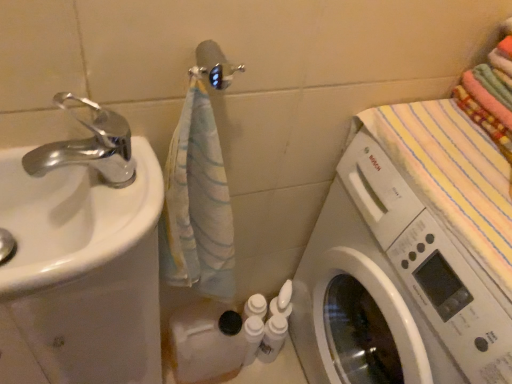
Question: Can you confirm if chrome metallic faucet at left is shorter than white plastic washing machine at right?

Choices:
 (A) no
 (B) yes

Answer: (B)

Question: Is chrome metallic faucet at left at the right side of white plastic washing machine at right?

Choices:
 (A) yes
 (B) no

Answer: (B)

Question: Considering the relative sizes of chrome metallic faucet at left and white plastic washing machine at right in the image provided, is chrome metallic faucet at left taller than white plastic washing machine at right?

Choices:
 (A) no
 (B) yes

Answer: (A)

Question: Can you confirm if chrome metallic faucet at left is positioned to the left of white plastic washing machine at right?

Choices:
 (A) yes
 (B) no

Answer: (A)

Question: Is chrome metallic faucet at left thinner than white plastic washing machine at right?

Choices:
 (A) no
 (B) yes

Answer: (B)

Question: Is point (82, 203) positioned closer to the camera than point (259, 329)?

Choices:
 (A) closer
 (B) farther

Answer: (A)

Question: From the image's perspective, relative to white plastic bottles at center, the 1th toiletry viewed from the left, is white glossy sink at left above or below?

Choices:
 (A) above
 (B) below

Answer: (A)

Question: Considering the relative positions of white glossy sink at left and white plastic bottles at center, the 1th toiletry viewed from the left, in the image provided, is white glossy sink at left to the left or to the right of white plastic bottles at center, the 1th toiletry viewed from the left,?

Choices:
 (A) left
 (B) right

Answer: (A)

Question: Is white glossy sink at left taller or shorter than white plastic bottles at center, which is the second toiletry from right to left?

Choices:
 (A) tall
 (B) short

Answer: (B)

Question: Based on their positions, is white glossy bottles at lower center, which appears as the first toiletry when viewed from the right, located to the left or right of white plastic bottles at center, which is the second toiletry from right to left?

Choices:
 (A) left
 (B) right

Answer: (B)

Question: Looking at the image, does white glossy bottles at lower center, the 2th toiletry when ordered from left to right, seem bigger or smaller compared to white plastic bottles at center, which is the second toiletry from right to left?

Choices:
 (A) small
 (B) big

Answer: (B)

Question: Relative to white plastic bottles at center, which is the second toiletry from right to left, is white glossy bottles at lower center, which appears as the first toiletry when viewed from the right, in front or behind?

Choices:
 (A) front
 (B) behind

Answer: (B)

Question: From a real-world perspective, is white glossy bottles at lower center, the 2th toiletry when ordered from left to right, physically located above or below white plastic bottles at center, the 1th toiletry viewed from the left?

Choices:
 (A) above
 (B) below

Answer: (A)

Question: Is white plastic washing machine at right wider or thinner than white glossy sink at left?

Choices:
 (A) thin
 (B) wide

Answer: (B)

Question: Is white plastic washing machine at right inside or outside of white glossy sink at left?

Choices:
 (A) outside
 (B) inside

Answer: (A)